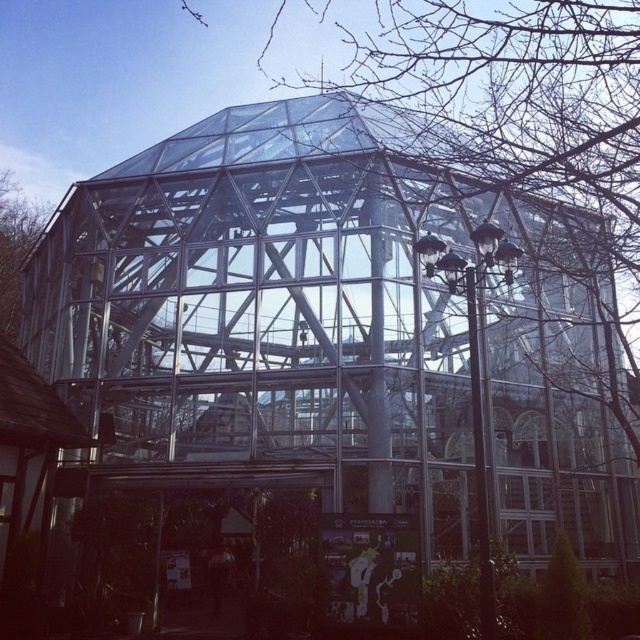
Question: Does transparent glass dome at center appear on the right side of brown wood tree at left?

Choices:
 (A) no
 (B) yes

Answer: (B)

Question: Does transparent glass dome at center appear over brown wood tree at left?

Choices:
 (A) yes
 (B) no

Answer: (A)

Question: Is transparent glass dome at center bigger than brown wood tree at left?

Choices:
 (A) yes
 (B) no

Answer: (A)

Question: Which object is closer to the camera taking this photo?

Choices:
 (A) transparent glass dome at center
 (B) brown wood tree at left

Answer: (A)

Question: Which of the following is the farthest from the observer?

Choices:
 (A) (20, 285)
 (B) (600, 145)

Answer: (A)